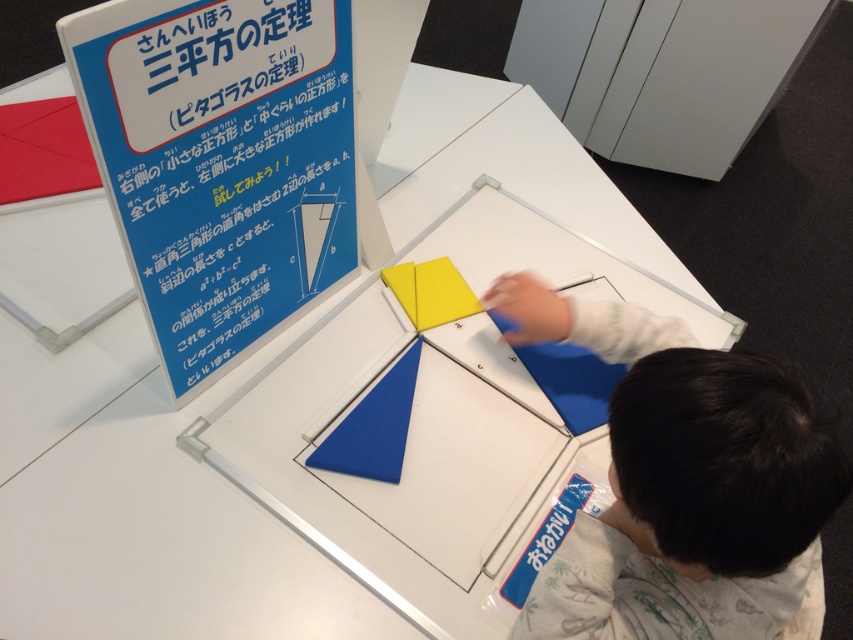
Question: Is blue paper sign at upper left bigger than smooth blue fabric at lower right?

Choices:
 (A) yes
 (B) no

Answer: (A)

Question: Which point is farther to the camera?

Choices:
 (A) (672, 541)
 (B) (264, 144)

Answer: (B)

Question: Can you confirm if blue paper sign at upper left is smaller than smooth blue fabric at lower right?

Choices:
 (A) yes
 (B) no

Answer: (B)

Question: Is blue paper sign at upper left thinner than smooth blue fabric at lower right?

Choices:
 (A) yes
 (B) no

Answer: (A)

Question: Which object is farther from the camera taking this photo?

Choices:
 (A) blue paper sign at upper left
 (B) smooth blue fabric at lower right

Answer: (A)